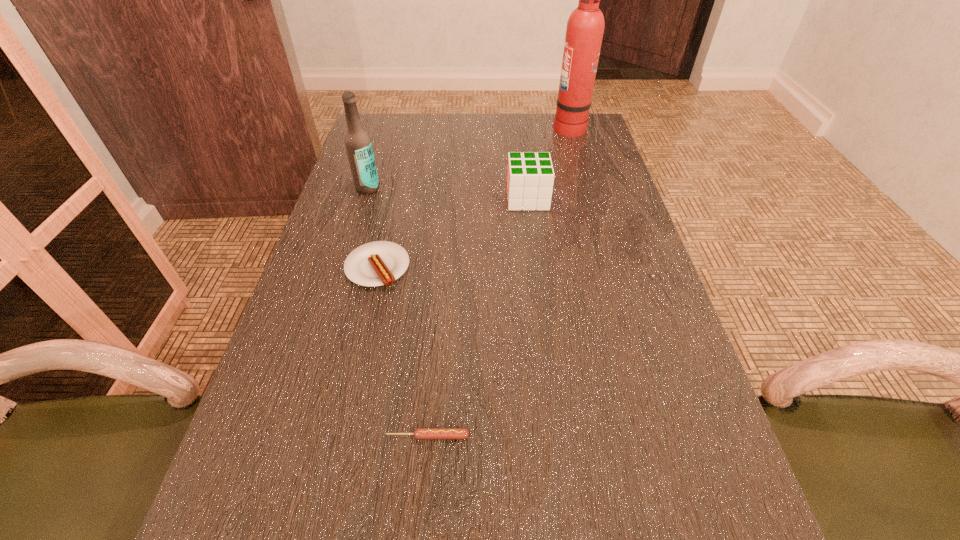
At what (x,y) coordinates should I click in order to perform the action: click on free spot that satisfies the following two spatial constraints: 1. on the label of the beer bottle; 2. on the left side of the fourth tallest object. Please return your answer as a coordinate pair (x, y). The width and height of the screenshot is (960, 540). Looking at the image, I should click on (344, 268).

Find the location of a particular element. This screenshot has width=960, height=540. vacant area in the image that satisfies the following two spatial constraints: 1. on the label of the farther sausage; 2. on the right side of the beer bottle is located at coordinates (344, 268).

The width and height of the screenshot is (960, 540). I want to click on vacant space that satisfies the following two spatial constraints: 1. on the label side of the fire extinguisher; 2. on the front side of the right sausage, so click(x=660, y=436).